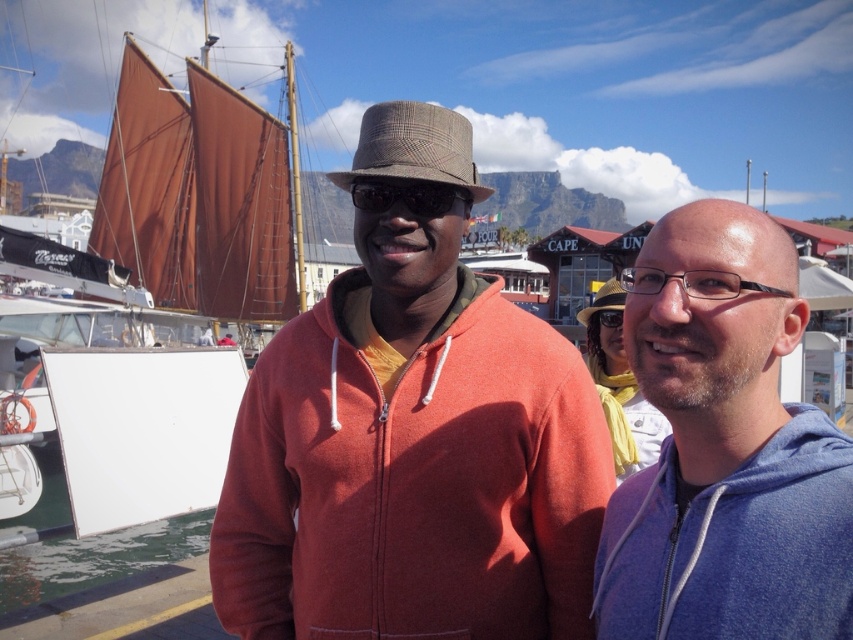
Question: Which of the following is the farthest from the observer?

Choices:
 (A) black plastic glasses at right
 (B) matte orange hoodie at center

Answer: (B)

Question: Does blue fleece jacket at right appear on the right side of black plastic glasses at right?

Choices:
 (A) no
 (B) yes

Answer: (A)

Question: Can you confirm if brown canvas sailboat at left is positioned below black plastic goggles at center?

Choices:
 (A) no
 (B) yes

Answer: (A)

Question: Considering the real-world distances, which object is farthest from the black plastic glasses at right?

Choices:
 (A) brown textured hat at center
 (B) matte orange hoodie at center
 (C) black plastic goggles at center
 (D) brown plaid hat at center

Answer: (D)

Question: Which point is farther from the camera taking this photo?

Choices:
 (A) (718, 596)
 (B) (589, 632)
 (C) (601, 305)
 (D) (616, 324)

Answer: (D)

Question: Does brown plaid hat at center have a smaller size compared to black plastic goggles at center?

Choices:
 (A) no
 (B) yes

Answer: (A)